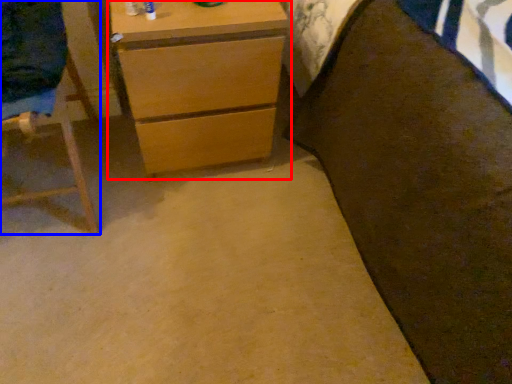
Question: Which of the following is the farthest to the observer, chest of drawers (highlighted by a red box) or furniture (highlighted by a blue box)?

Choices:
 (A) chest of drawers
 (B) furniture

Answer: (A)